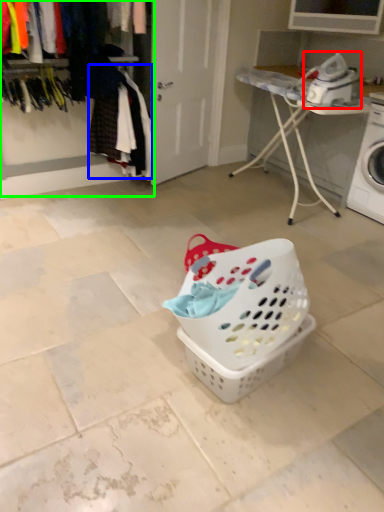
Question: Which object is the farthest from appliance (highlighted by a red box)? Choose among these: clothing (highlighted by a blue box) or closet (highlighted by a green box).

Choices:
 (A) clothing
 (B) closet

Answer: (B)